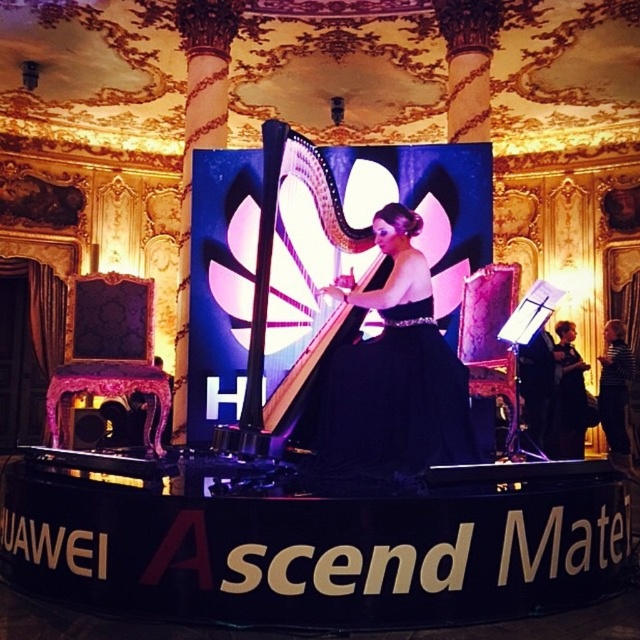
Does black satin dress at center appear on the left side of shiny silver harp at center?

In fact, black satin dress at center is to the right of shiny silver harp at center.

Does point (401, 390) come behind point (244, 426)?

Yes, it is.

Locate an element on the screen. This screenshot has height=640, width=640. black satin dress at center is located at coordinates (392, 378).